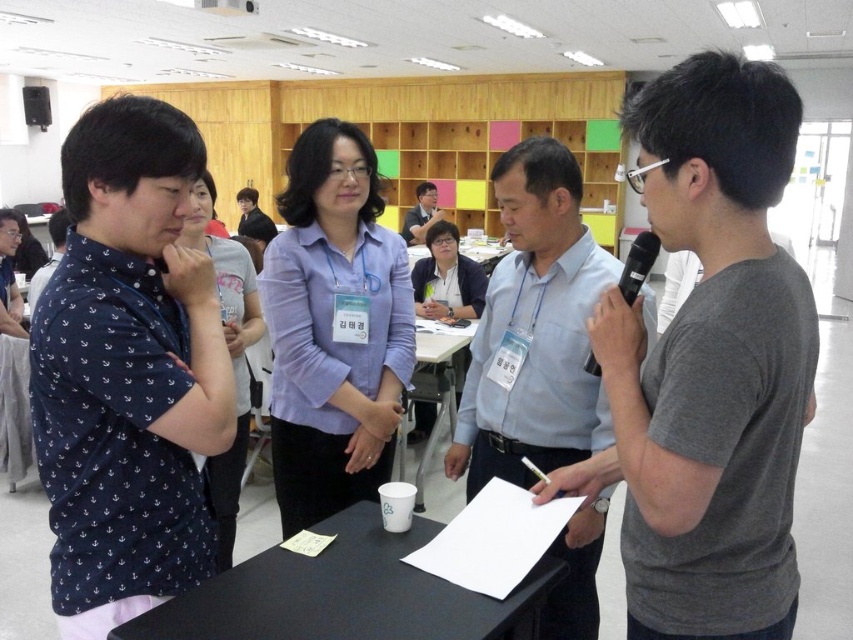
You are standing in the conference room and want to move from point A to point B. Point A is at coordinate point (x=740, y=609) and point B is at coordinate point (x=593, y=362). According to the scene description, which direction should you move to go from point A to point B?

To move from point A at coordinate point (x=740, y=609) to point B at coordinate point (x=593, y=362), you should move towards the upper left direction since point A is in front of point B.